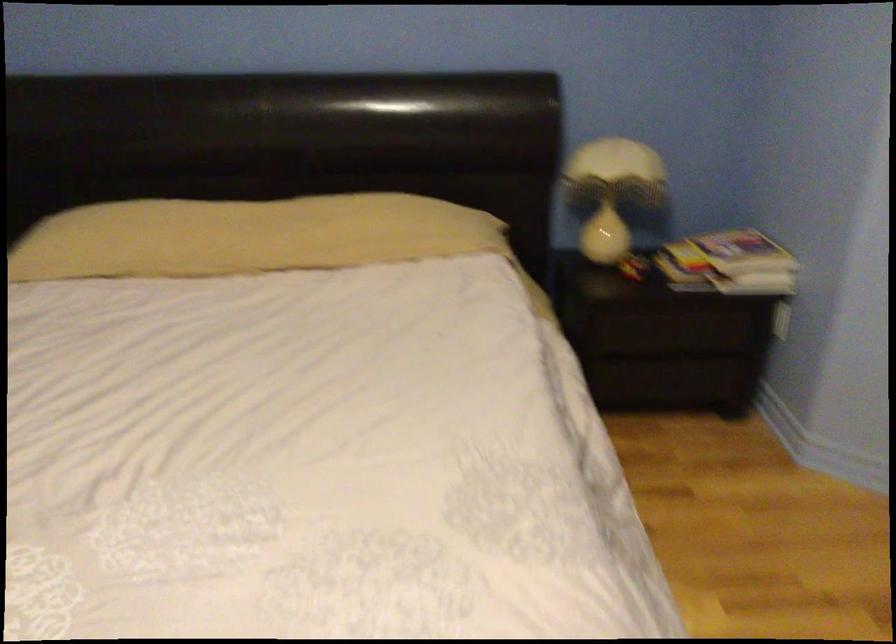
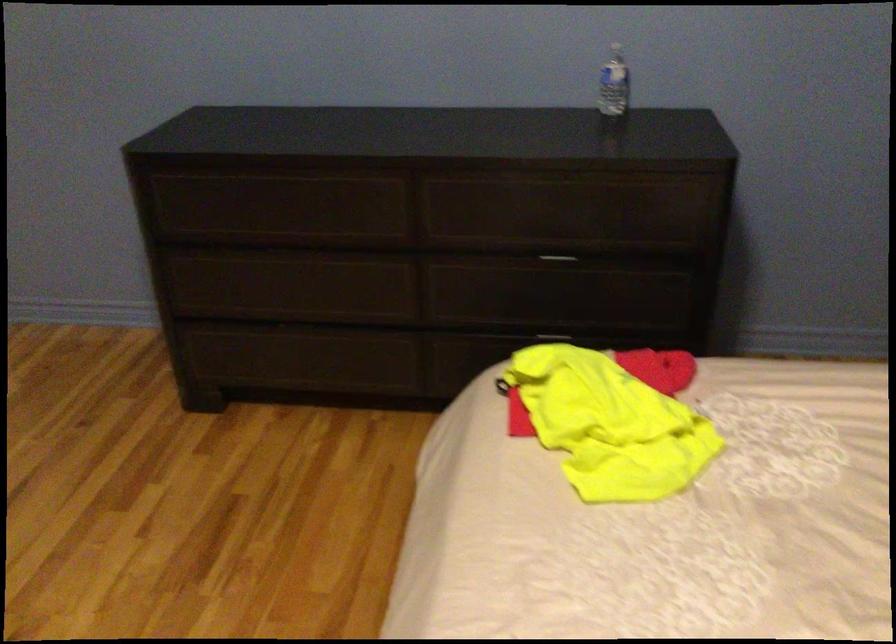
First-person continuous shooting, in which direction is the camera rotating?

The rotation direction of the camera is left-down.